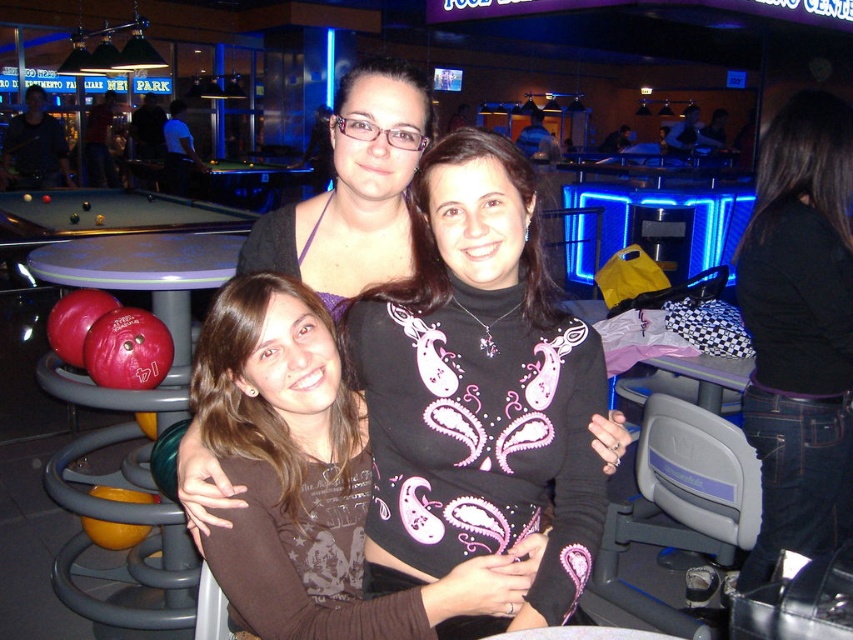
You are a photographer trying to capture a clear shot of the matte black top at center and the black denim jeans at lower right. Since you want both items to be visible in the frame, would adjusting the camera angle upwards help achieve this?

The black denim jeans at lower right is positioned under the matte black top at center, so adjusting the camera angle upwards might not be necessary. Keeping the camera level or slightly lowered could ensure both items are visible without obstruction.

You are a photographer trying to capture a group photo of the three people in the scene. You notice the brown fabric shirt at center and the matte black top at center. Which of these two items is wider in the image?

The brown fabric shirt at center is wider than the matte black top at center according to the description.